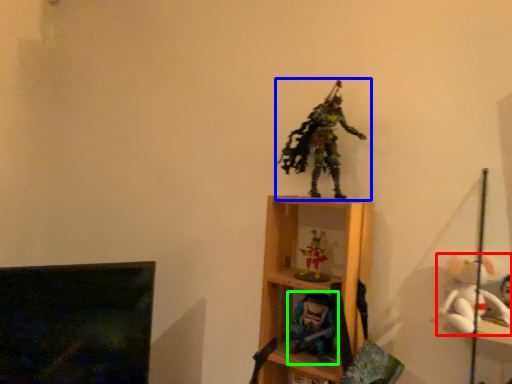
Question: Which object is the closest to the toy (highlighted by a red box)? Choose among these: toy (highlighted by a blue box) or toy (highlighted by a green box).

Choices:
 (A) toy
 (B) toy

Answer: (B)